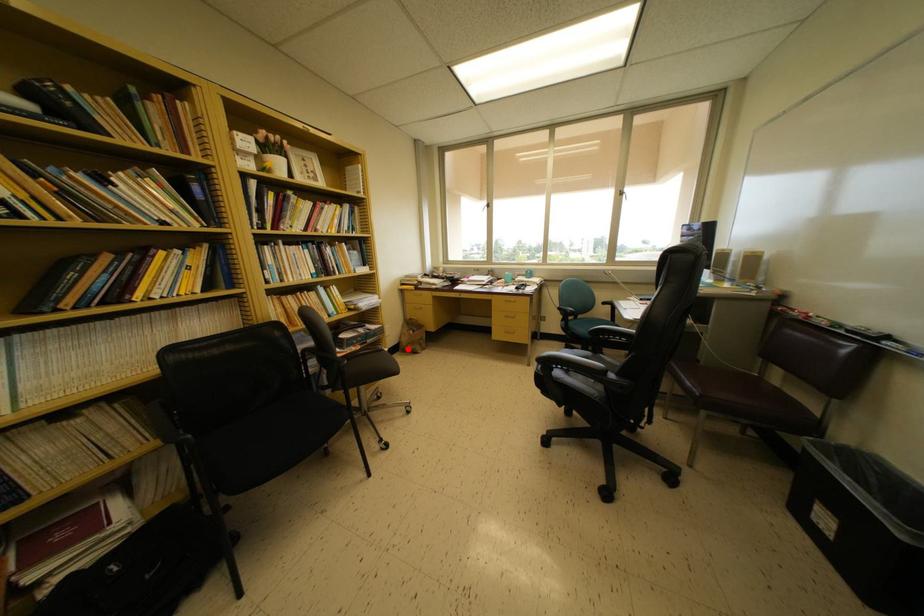
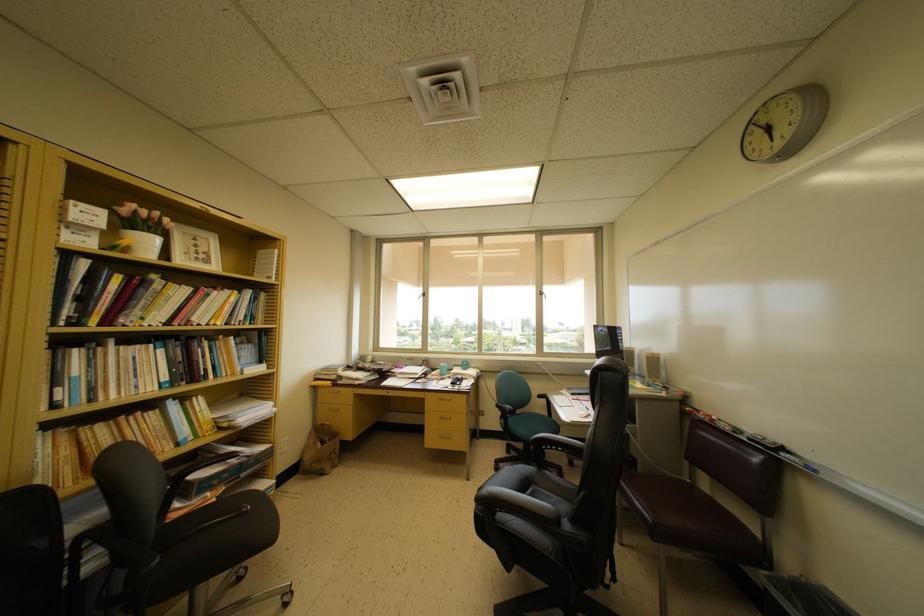
Question: I am providing you with two images of the same scene from different viewpoints. Image1 has a red point marked. In image2, the corresponding 3D location appears at what relative position? Reply with the corresponding letter.

Choices:
 (A) Closer
 (B) Farther

Answer: (B)